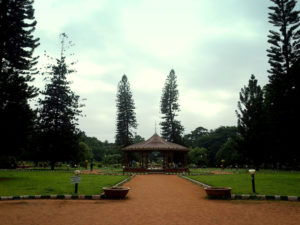
Find the location of a particular element. This screenshot has height=225, width=300. pot is located at coordinates (114, 192).